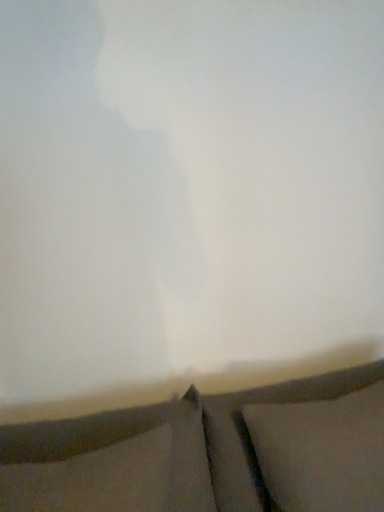
Question: Is white soft pillow at lower right, which is the 2th pillow from left to right, at the back of textured gray curtain at bottom?

Choices:
 (A) no
 (B) yes

Answer: (B)

Question: Can you confirm if textured gray curtain at bottom is wider than white soft pillow at lower right, the first pillow in the right-to-left sequence?

Choices:
 (A) yes
 (B) no

Answer: (A)

Question: Is textured gray curtain at bottom positioned far away from white soft pillow at lower right, the first pillow in the right-to-left sequence?

Choices:
 (A) yes
 (B) no

Answer: (B)

Question: Considering the relative positions of textured gray curtain at bottom and white soft pillow at lower right, which is the 2th pillow from left to right, in the image provided, is textured gray curtain at bottom to the right of white soft pillow at lower right, which is the 2th pillow from left to right, from the viewer's perspective?

Choices:
 (A) yes
 (B) no

Answer: (B)

Question: Is textured gray curtain at bottom completely or partially outside of white soft pillow at lower right, the first pillow in the right-to-left sequence?

Choices:
 (A) no
 (B) yes

Answer: (B)

Question: Based on their sizes in the image, would you say white soft pillow at lower right, the first pillow in the right-to-left sequence, is bigger or smaller than textured gray curtain at bottom?

Choices:
 (A) small
 (B) big

Answer: (A)

Question: Is white soft pillow at lower right, which is the 2th pillow from left to right, taller or shorter than textured gray curtain at bottom?

Choices:
 (A) short
 (B) tall

Answer: (A)

Question: Is point (301, 485) positioned closer to the camera than point (205, 412)?

Choices:
 (A) farther
 (B) closer

Answer: (B)

Question: Is white soft pillow at lower right, which is the 2th pillow from left to right, in front of or behind textured gray curtain at bottom in the image?

Choices:
 (A) front
 (B) behind

Answer: (B)

Question: Is textured gray curtain at bottom to the left or to the right of white soft pillow at lower right, the first pillow in the right-to-left sequence, in the image?

Choices:
 (A) right
 (B) left

Answer: (B)

Question: From a real-world perspective, is textured gray curtain at bottom positioned above or below white soft pillow at lower right, the first pillow in the right-to-left sequence?

Choices:
 (A) below
 (B) above

Answer: (A)

Question: Considering the positions of point coord(238,490) and point coord(350,411), is point coord(238,490) closer or farther from the camera than point coord(350,411)?

Choices:
 (A) closer
 (B) farther

Answer: (B)

Question: Is textured gray curtain at bottom in front of or behind white soft pillow at lower right, the first pillow in the right-to-left sequence, in the image?

Choices:
 (A) behind
 (B) front

Answer: (B)

Question: Visually, is dark gray fabric pillow at lower center, the first pillow in the left-to-right sequence, positioned to the left or to the right of white soft pillow at lower right, which is the 2th pillow from left to right?

Choices:
 (A) left
 (B) right

Answer: (A)

Question: From the image's perspective, relative to white soft pillow at lower right, which is the 2th pillow from left to right, is dark gray fabric pillow at lower center, positioned as the 2th pillow in right-to-left order, above or below?

Choices:
 (A) below
 (B) above

Answer: (B)